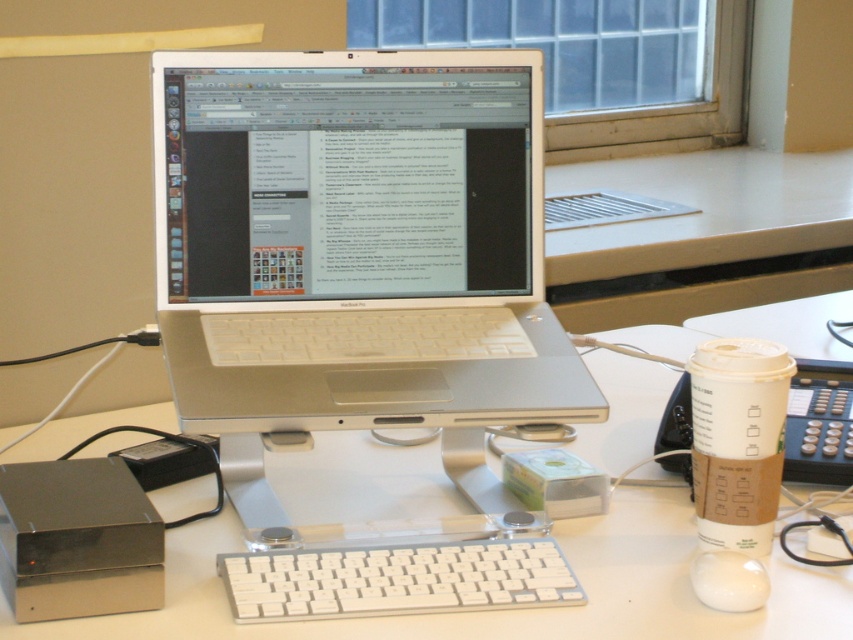
Who is more distant from viewer, (196, 586) or (229, 573)?

Point (196, 586)

Is white plastic computer desk at center further to the viewer compared to white plastic keyboard at center?

No.

Is point (19, 628) farther from viewer compared to point (503, 584)?

No, it is not.

At what (x,y) coordinates should I click in order to perform the action: click on white plastic computer desk at center. Please return your answer as a coordinate pair (x, y). This screenshot has width=853, height=640. Looking at the image, I should click on (515, 609).

Does white plastic laptop at center come in front of white plastic keyboard at center?

No, white plastic laptop at center is further to the viewer.

Is white plastic laptop at center smaller than white plastic keyboard at center?

Actually, white plastic laptop at center might be larger than white plastic keyboard at center.

Which is in front, point (521, 141) or point (271, 588)?

Point (271, 588) is in front.

Where is `white plastic laptop at center`? This screenshot has height=640, width=853. white plastic laptop at center is located at coordinates (347, 179).

The width and height of the screenshot is (853, 640). I want to click on white plastic computer desk at center, so click(515, 609).

Which is in front, point (666, 627) or point (750, 602)?

Point (666, 627)

Describe the element at coordinates (515, 609) in the screenshot. This screenshot has width=853, height=640. I see `white plastic computer desk at center` at that location.

This screenshot has width=853, height=640. Find the location of `white plastic computer desk at center`. white plastic computer desk at center is located at coordinates (515, 609).